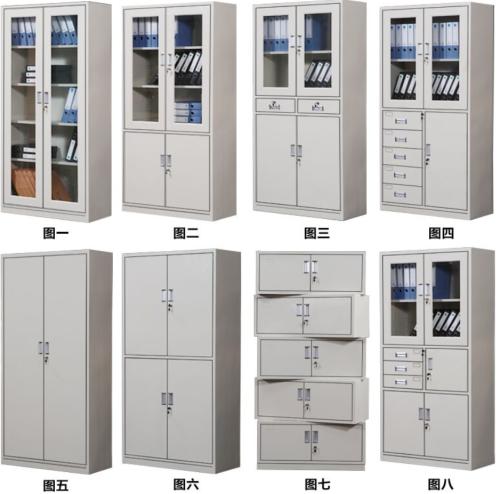
Image resolution: width=500 pixels, height=494 pixels. In order to click on glass door white cabinet on top left in this screenshot , I will do `click(101, 133)`.